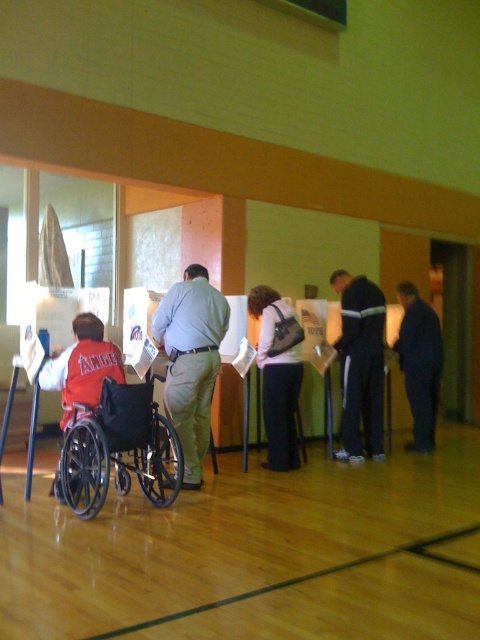
Question: Can you confirm if dark blue jeans at center is bigger than red fleece jacket at left?

Choices:
 (A) yes
 (B) no

Answer: (B)

Question: Which point appears farthest from the camera in this image?

Choices:
 (A) (265, 403)
 (B) (107, 355)
 (C) (201, 305)
 (D) (363, 342)

Answer: (D)

Question: From the image, what is the correct spatial relationship of black matte wheelchair at left in relation to dark blue jeans at center?

Choices:
 (A) left
 (B) right

Answer: (A)

Question: Which is farther from the light green fabric pants at center?

Choices:
 (A) dark gray tracksuit at center
 (B) dark gray fabric jacket at center

Answer: (A)

Question: Is black matte wheelchair at left behind light green fabric pants at center?

Choices:
 (A) no
 (B) yes

Answer: (A)

Question: Which point is closer to the camera?

Choices:
 (A) (91, 410)
 (B) (162, 316)
 (C) (427, 436)
 (D) (362, 282)

Answer: (A)